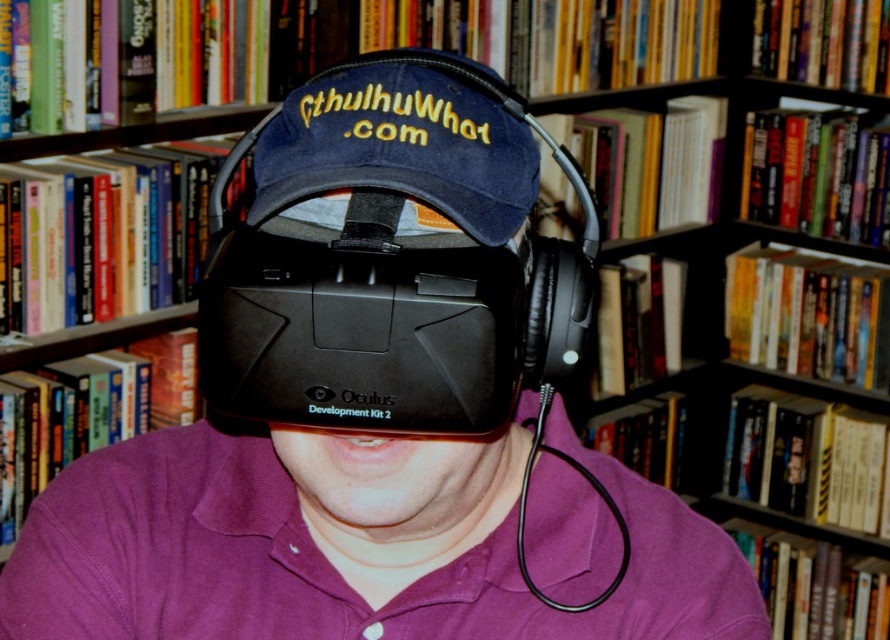
Question: Can you confirm if black matte vr headset at center is bigger than denim baseball cap at center?

Choices:
 (A) yes
 (B) no

Answer: (A)

Question: Is the position of black matte vr headset at center less distant than that of denim baseball cap at center?

Choices:
 (A) yes
 (B) no

Answer: (A)

Question: Which object appears farthest from the camera in this image?

Choices:
 (A) denim baseball cap at center
 (B) black matte vr headset at center

Answer: (A)

Question: Which of the following is the farthest from the observer?

Choices:
 (A) (312, 90)
 (B) (549, 380)

Answer: (B)

Question: Is black matte vr headset at center above denim baseball cap at center?

Choices:
 (A) no
 (B) yes

Answer: (A)